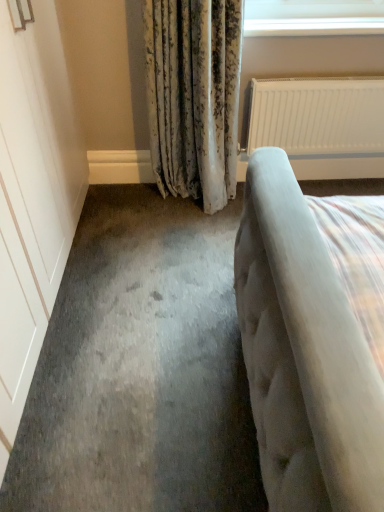
Measure the distance between point [371,95] and camera.

The distance of point [371,95] from camera is 7.10 feet.

Measure the distance between white textured radiator at upper right and camera.

The depth of white textured radiator at upper right is 7.02 feet.

The height and width of the screenshot is (512, 384). What do you see at coordinates (321, 125) in the screenshot? I see `white textured radiator at upper right` at bounding box center [321, 125].

I want to click on white textured radiator at upper right, so click(x=321, y=125).

Where is `white textured radiator at upper right`? This screenshot has height=512, width=384. white textured radiator at upper right is located at coordinates (321, 125).